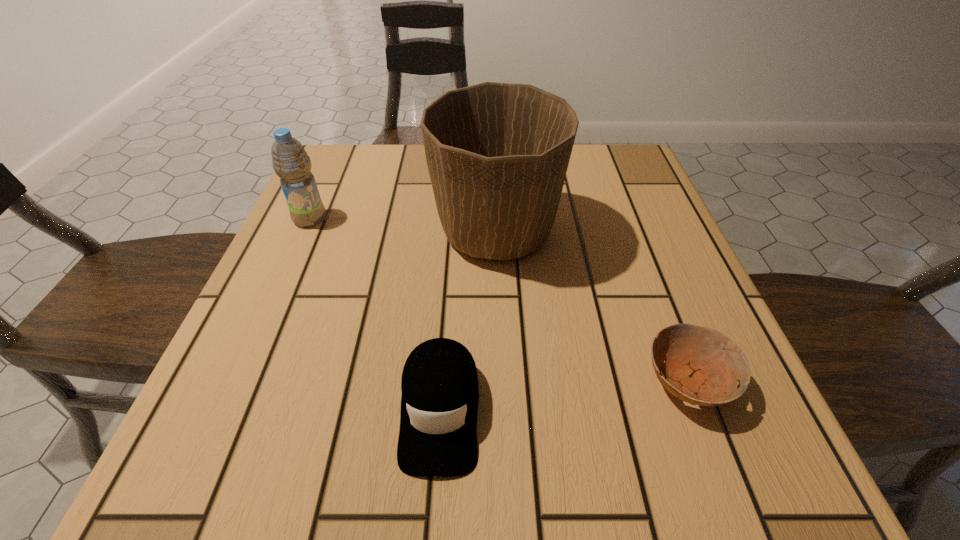
I want to click on object that is at the near edge, so [x=440, y=393].

At what (x,y) coordinates should I click in order to perform the action: click on object at the left edge. Please return your answer as a coordinate pair (x, y). Image resolution: width=960 pixels, height=540 pixels. Looking at the image, I should click on (290, 161).

Where is `object located at the right edge`? object located at the right edge is located at coordinates (699, 360).

This screenshot has height=540, width=960. Identify the location of vacant point at the far edge. (411, 184).

This screenshot has height=540, width=960. In order to click on free space at the near edge of the desktop in this screenshot , I will do `click(530, 459)`.

In the image, there is a desktop. What are the coordinates of `free space at the left edge` in the screenshot? It's located at (355, 199).

Locate an element on the screen. vacant area at the far right corner of the desktop is located at coordinates (609, 144).

Locate an element on the screen. This screenshot has height=540, width=960. blank space at the near right corner of the desktop is located at coordinates (781, 464).

Identify the location of unoccupied position between the third shortest object and the rightmost object. (498, 300).

Find the location of a particular element. Image resolution: width=960 pixels, height=540 pixels. unoccupied position between the third tallest object and the tallest object is located at coordinates (468, 321).